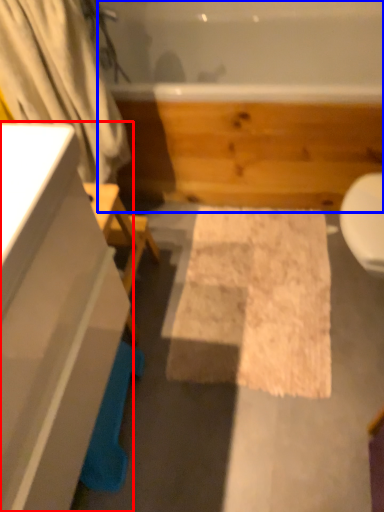
Question: Which object is further to the camera taking this photo, bathroom cabinet (highlighted by a red box) or jacuzzi (highlighted by a blue box)?

Choices:
 (A) bathroom cabinet
 (B) jacuzzi

Answer: (B)